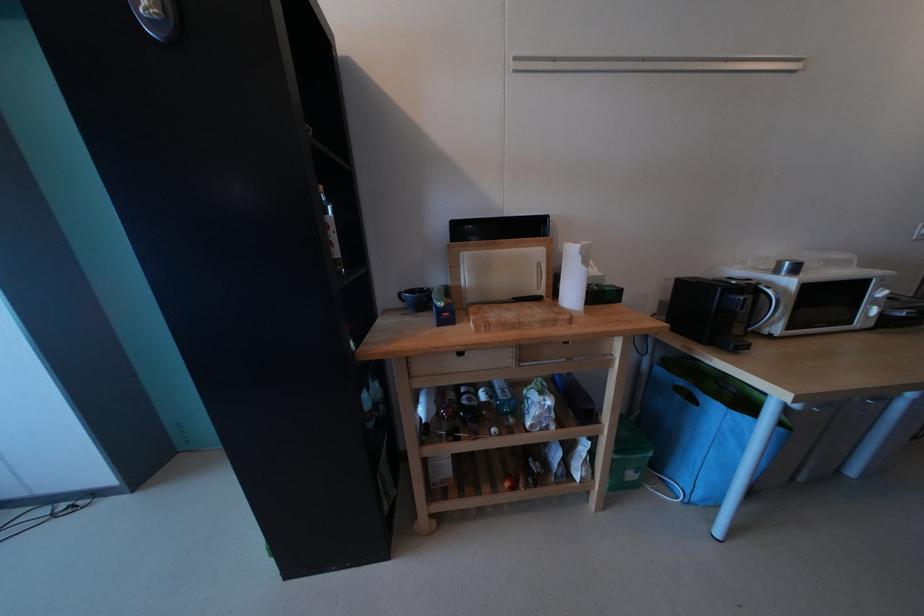
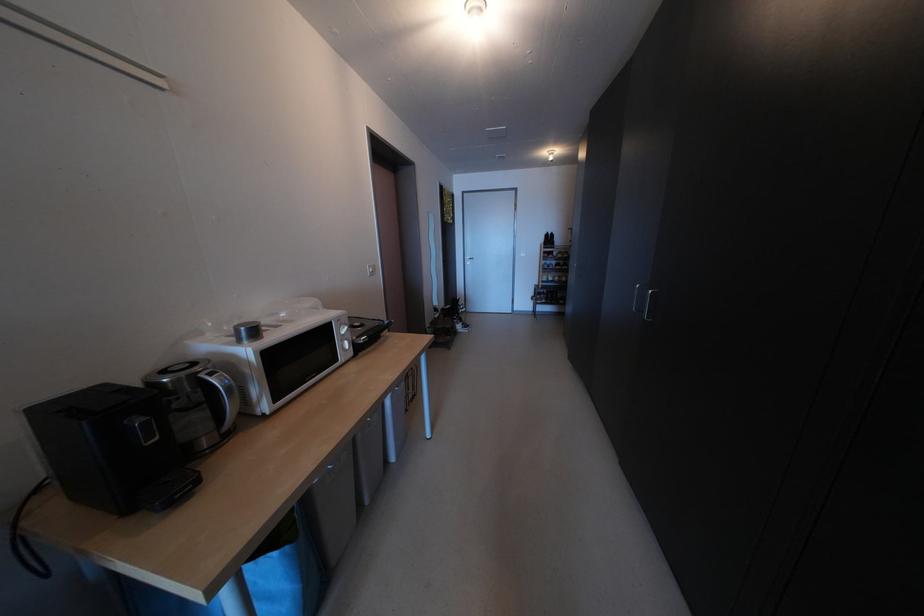
Question: The camera is either moving clockwise (left) or counter-clockwise (right) around the object. The first image is from the beginning of the video and the second image is from the end. Is the camera moving left or right when shooting the video?

Choices:
 (A) Left
 (B) Right

Answer: (A)